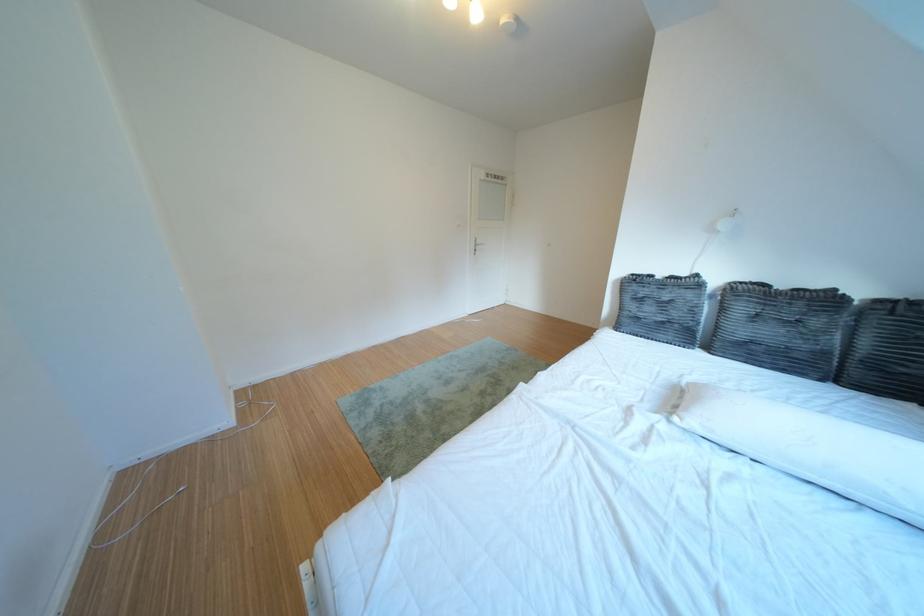
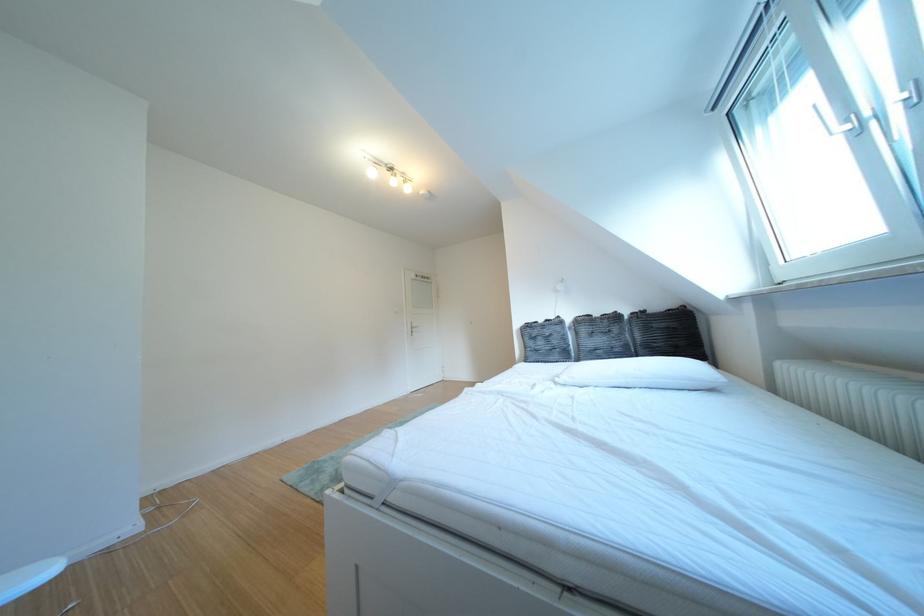
Which direction would the cameraman need to move to produce the second image?

The cameraman moved toward left, backward.